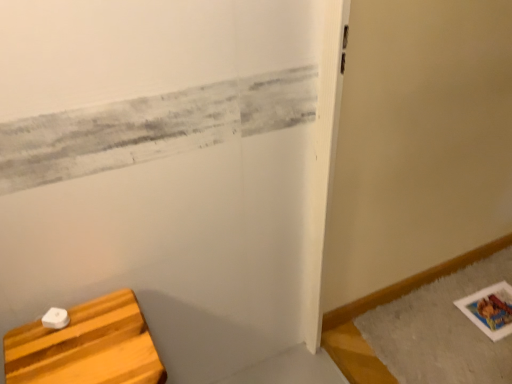
Question: Is gray fluffy bath mat at lower right to the left or to the right of white matte wood cutting board at lower left in the image?

Choices:
 (A) left
 (B) right

Answer: (B)

Question: In terms of size, does gray fluffy bath mat at lower right appear bigger or smaller than white matte wood cutting board at lower left?

Choices:
 (A) big
 (B) small

Answer: (B)

Question: Looking at their shapes, would you say gray fluffy bath mat at lower right is wider or thinner than white matte wood cutting board at lower left?

Choices:
 (A) wide
 (B) thin

Answer: (A)

Question: Looking at the image, does white matte wood cutting board at lower left seem bigger or smaller compared to gray fluffy bath mat at lower right?

Choices:
 (A) small
 (B) big

Answer: (B)

Question: In terms of width, does white matte wood cutting board at lower left look wider or thinner when compared to gray fluffy bath mat at lower right?

Choices:
 (A) wide
 (B) thin

Answer: (B)

Question: In the image, is white matte wood cutting board at lower left positioned in front of or behind gray fluffy bath mat at lower right?

Choices:
 (A) behind
 (B) front

Answer: (B)

Question: Is white matte wood cutting board at lower left taller or shorter than gray fluffy bath mat at lower right?

Choices:
 (A) short
 (B) tall

Answer: (B)